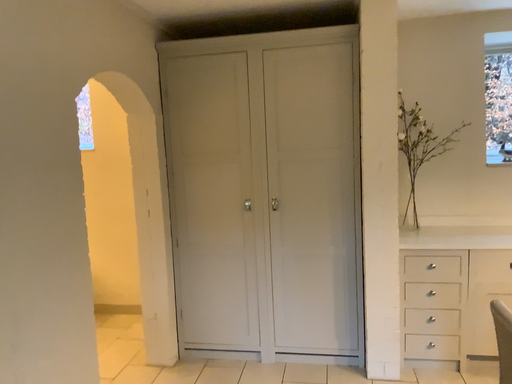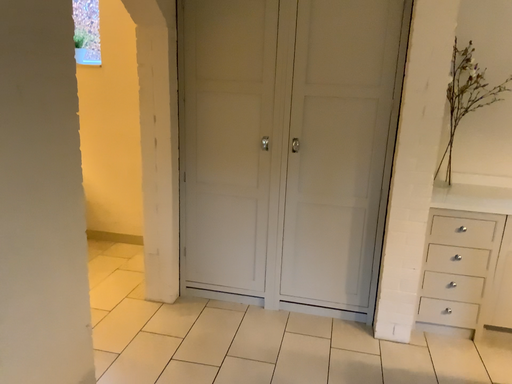
Question: How did the camera likely rotate when shooting the video?

Choices:
 (A) rotated downward
 (B) rotated upward

Answer: (A)